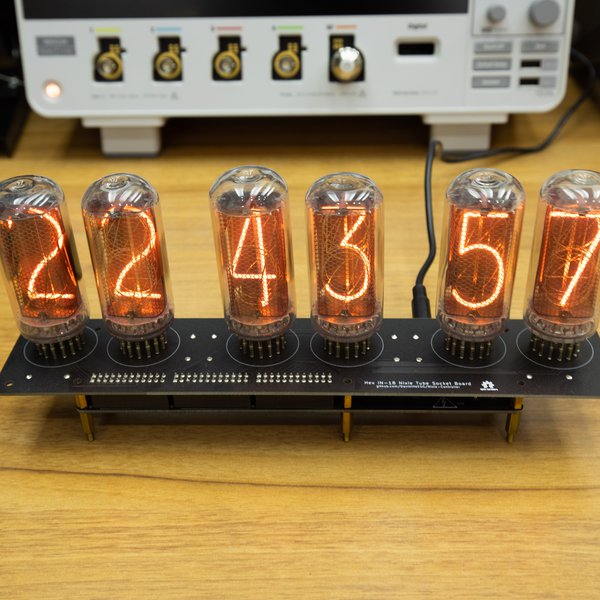
The height and width of the screenshot is (600, 600). Find the location of `bulbs`. bulbs is located at coordinates (41, 190), (133, 192), (261, 199), (353, 194), (487, 188), (567, 190).